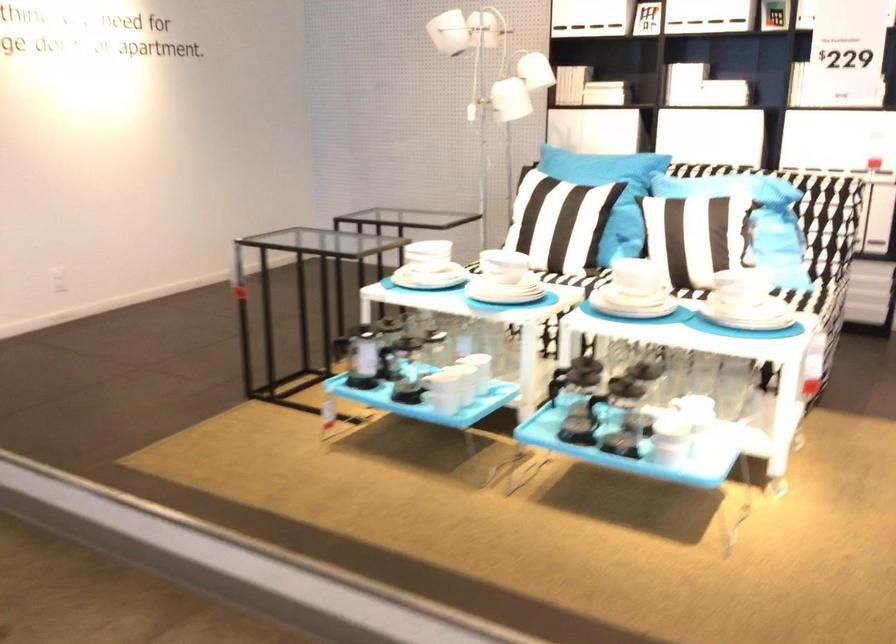
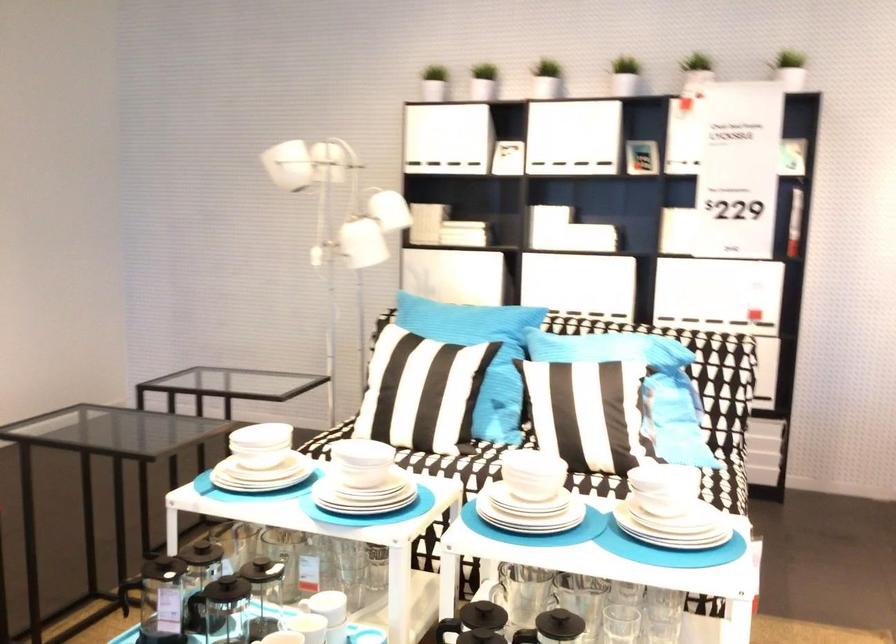
Where in the second image is the point corresponding to point (503, 263) from the first image?

(360, 464)